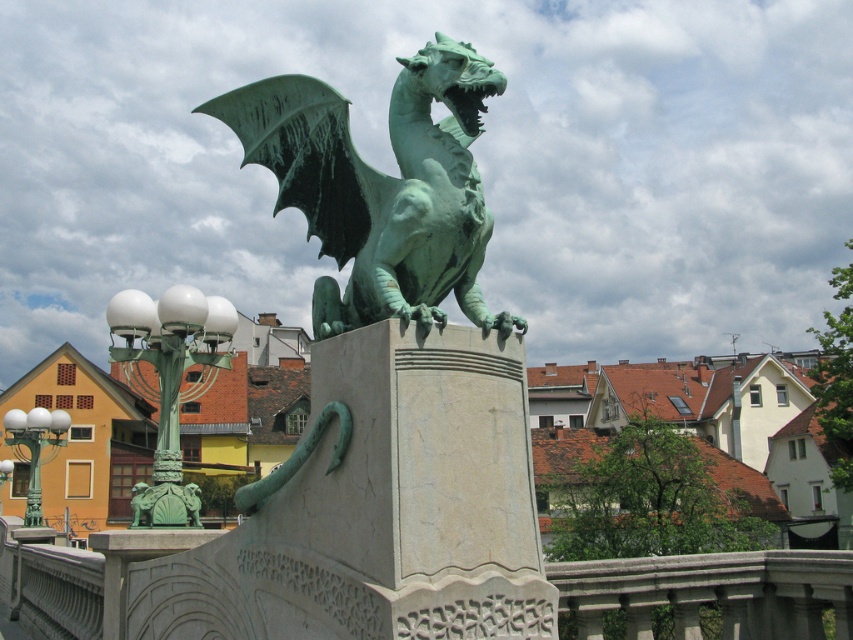
Question: Where is green patina dragon at center located in relation to green metal/bronze lamp post at lower left in the image?

Choices:
 (A) above
 (B) below

Answer: (A)

Question: Which object is the closest to the green patina dragon at center?

Choices:
 (A) green glass lamp post at left
 (B) green metal/bronze lamp post at lower left

Answer: (B)

Question: Considering the real-world distances, which object is closest to the green patina dragon at center?

Choices:
 (A) green matte lamp post at left
 (B) green glass lamp post at left
 (C) green metal/bronze lamp post at lower left

Answer: (C)

Question: Which point is farther to the camera?

Choices:
 (A) green matte lamp post at left
 (B) green patina dragon at center
 (C) green metal/bronze lamp post at lower left

Answer: (C)

Question: Is green matte lamp post at left smaller than green metal/bronze lamp post at lower left?

Choices:
 (A) no
 (B) yes

Answer: (A)

Question: Is green patina dragon at center positioned before green metal/bronze lamp post at lower left?

Choices:
 (A) no
 (B) yes

Answer: (B)